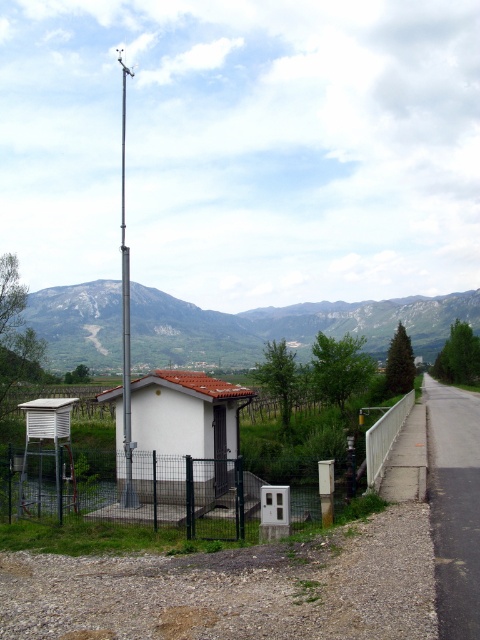
Question: Estimate the real-world distances between objects in this image. Which object is closer to the metal wire mesh fence at lower center?

Choices:
 (A) gray rocky mountain at center
 (B) silver metallic pole at center

Answer: (B)

Question: Among these objects, which one is farthest from the camera?

Choices:
 (A) silver metallic pole at center
 (B) metal wire mesh fence at lower center
 (C) gray rocky mountain at center

Answer: (C)

Question: Considering the relative positions of metal wire mesh fence at lower center and silver metallic pole at center in the image provided, where is metal wire mesh fence at lower center located with respect to silver metallic pole at center?

Choices:
 (A) below
 (B) above

Answer: (A)

Question: Does gray rocky mountain at center have a lesser width compared to metal wire mesh fence at lower center?

Choices:
 (A) yes
 (B) no

Answer: (B)

Question: Does gray rocky mountain at center appear on the left side of silver metallic pole at center?

Choices:
 (A) no
 (B) yes

Answer: (A)

Question: Which point is farther from the camera taking this photo?

Choices:
 (A) (272, 308)
 (B) (123, 248)

Answer: (A)